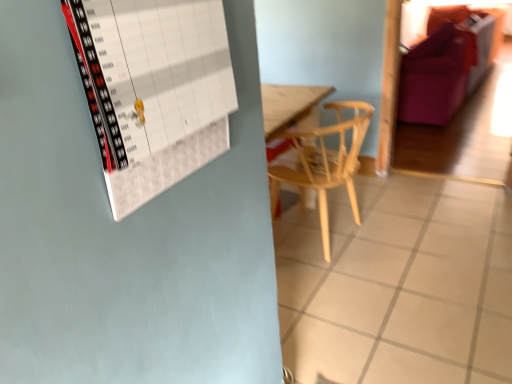
You are a GUI agent. You are given a task and a screenshot of the screen. Output one action in this format:
    pyautogui.click(x=<x>, y=<y>)
    Task: Click on the vacant area that is situated to the right of light wood chair at center
    This screenshot has width=512, height=384.
    Given the screenshot: What is the action you would take?
    pyautogui.click(x=438, y=243)